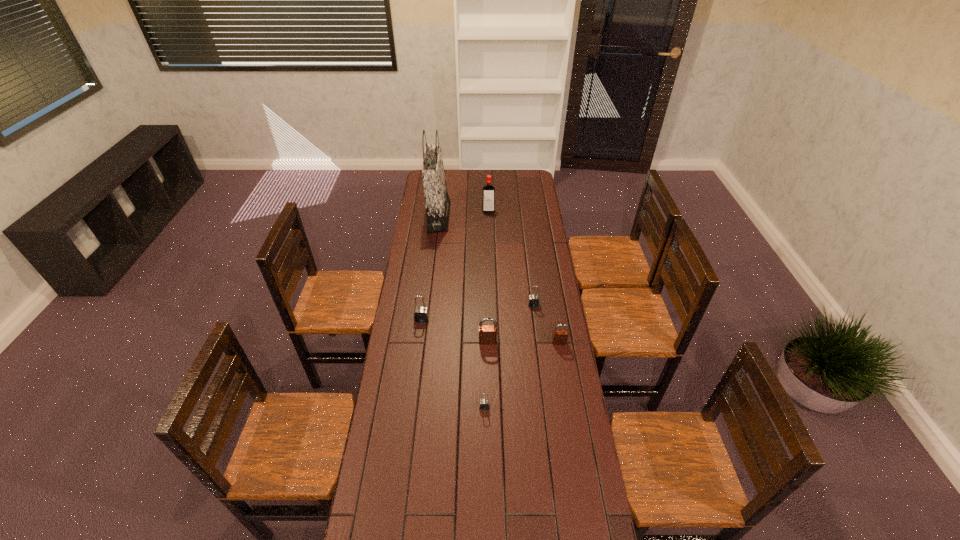
You are a GUI agent. You are given a task and a screenshot of the screen. Output one action in this format:
    pyautogui.click(x=<x>, y=<y>)
    Task: Click on the second gray padlock from left to right
    The width and height of the screenshot is (960, 540).
    Given the screenshot: What is the action you would take?
    pyautogui.click(x=484, y=404)

This screenshot has height=540, width=960. I want to click on the shortest padlock, so click(484, 404).

Where is `vacant region located on the front of the tallest object with the design`? vacant region located on the front of the tallest object with the design is located at coordinates click(x=488, y=217).

Where is `free region located 0.150m on the front and back of the red vodka`? The width and height of the screenshot is (960, 540). free region located 0.150m on the front and back of the red vodka is located at coordinates (489, 229).

What are the coordinates of `free space located on the shackle of the leftmost gray padlock` in the screenshot? It's located at (414, 380).

Find the location of `free space located on the front-facing side of the bigger brown padlock`. free space located on the front-facing side of the bigger brown padlock is located at coordinates (488, 356).

Identify the location of blank area located on the shackle of the farthest gray padlock. (537, 329).

Locate an element on the screen. The image size is (960, 540). blank space located 0.150m on the front-facing side of the smaller brown padlock is located at coordinates (564, 375).

Locate an element on the screen. free spot located 0.310m on the shackle of the nearest object is located at coordinates (485, 497).

The height and width of the screenshot is (540, 960). I want to click on shopping bag located at the left edge, so click(x=437, y=202).